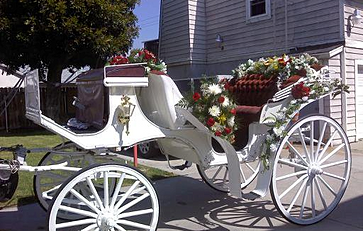
At what (x,y) coordinates should I click in order to perform the action: click on seat. Please return your answer as a coordinate pair (x, y). The image size is (363, 231). Looking at the image, I should click on (253, 93).